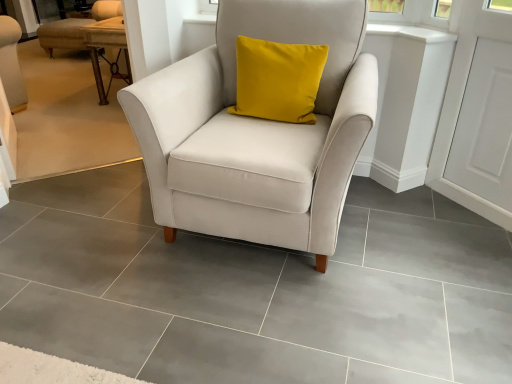
Question: Is white smooth window sill at upper center positioned before satin white armchair at center?

Choices:
 (A) no
 (B) yes

Answer: (A)

Question: Is satin white armchair at center a part of white smooth window sill at upper center?

Choices:
 (A) no
 (B) yes

Answer: (A)

Question: Is white smooth window sill at upper center at the right side of satin white armchair at center?

Choices:
 (A) yes
 (B) no

Answer: (A)

Question: From a real-world perspective, is white smooth window sill at upper center physically below satin white armchair at center?

Choices:
 (A) yes
 (B) no

Answer: (B)

Question: Can you confirm if white smooth window sill at upper center is shorter than satin white armchair at center?

Choices:
 (A) yes
 (B) no

Answer: (A)

Question: From the image's perspective, is white smooth window sill at upper center above satin white armchair at center?

Choices:
 (A) no
 (B) yes

Answer: (B)

Question: Is white smooth window sill at upper center at the right side of wooden textured table at upper left?

Choices:
 (A) yes
 (B) no

Answer: (A)

Question: Is white smooth window sill at upper center taller than wooden textured table at upper left?

Choices:
 (A) no
 (B) yes

Answer: (A)

Question: Is white smooth window sill at upper center wider than wooden textured table at upper left?

Choices:
 (A) no
 (B) yes

Answer: (A)

Question: Does white smooth window sill at upper center have a lesser width compared to wooden textured table at upper left?

Choices:
 (A) yes
 (B) no

Answer: (A)

Question: Is white smooth window sill at upper center directly adjacent to wooden textured table at upper left?

Choices:
 (A) no
 (B) yes

Answer: (A)

Question: Is white smooth window sill at upper center far away from wooden textured table at upper left?

Choices:
 (A) yes
 (B) no

Answer: (A)

Question: Can you confirm if satin white armchair at center is positioned to the left of white smooth window sill at upper center?

Choices:
 (A) no
 (B) yes

Answer: (B)